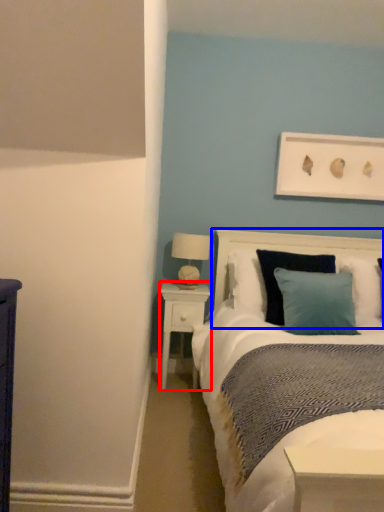
Question: Which of the following is the closest to the observer, nightstand (highlighted by a red box) or headboard (highlighted by a blue box)?

Choices:
 (A) nightstand
 (B) headboard

Answer: (B)